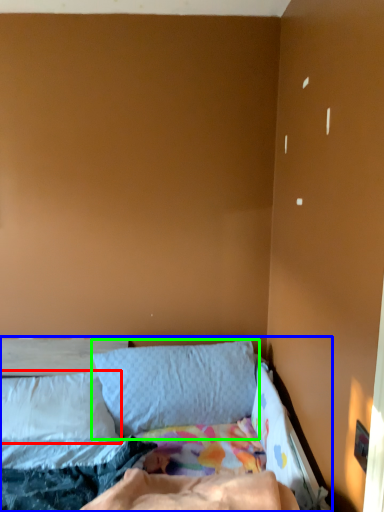
Question: Estimate the real-world distances between objects in this image. Which object is closer to pillow (highlighted by a red box), bed (highlighted by a blue box) or pillow (highlighted by a green box)?

Choices:
 (A) bed
 (B) pillow

Answer: (A)